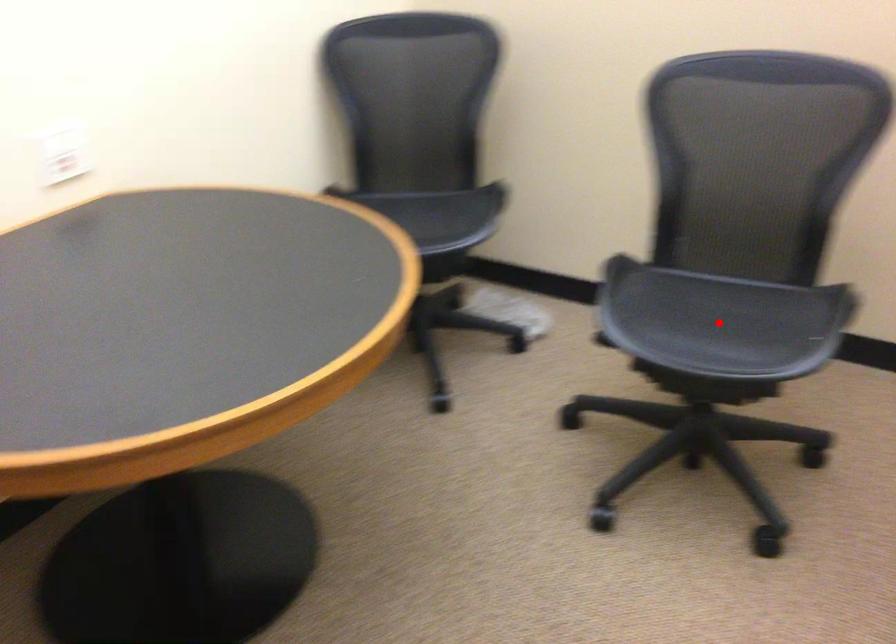
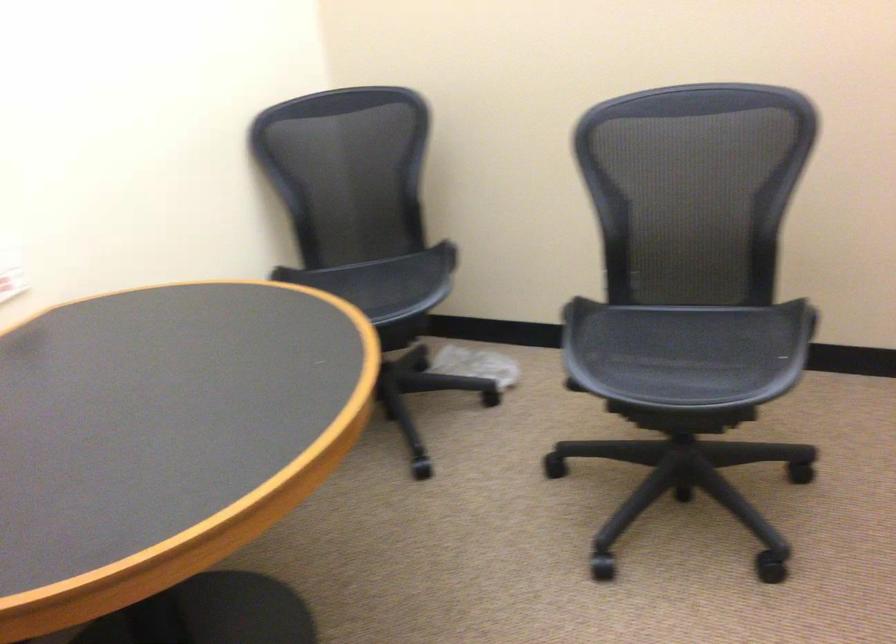
Where in the second image is the point corresponding to the highlighted location from the first image?

(686, 352)